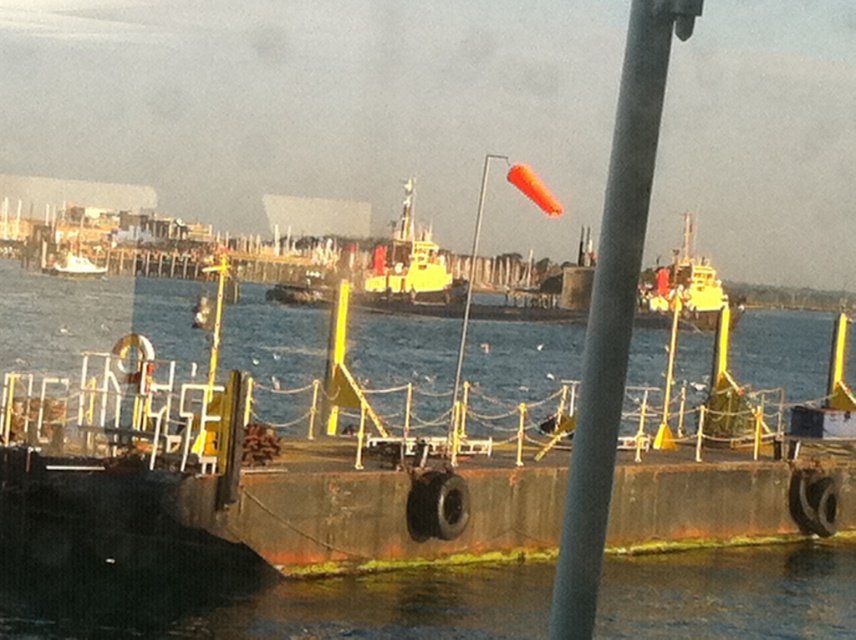
Between blue water at center and metallic gray pole at center, which one appears on the left side from the viewer's perspective?

blue water at center

Can you confirm if blue water at center is shorter than metallic gray pole at center?

In fact, blue water at center may be taller than metallic gray pole at center.

Locate an element on the screen. The width and height of the screenshot is (856, 640). blue water at center is located at coordinates (88, 317).

Does blue water at center appear over white matte boat at left?

Actually, blue water at center is below white matte boat at left.

Who is lower down, blue water at center or white matte boat at left?

blue water at center is below.

Measure the distance between blue water at center and camera.

6.98 meters

At what (x,y) coordinates should I click in order to perform the action: click on blue water at center. Please return your answer as a coordinate pair (x, y). The height and width of the screenshot is (640, 856). Looking at the image, I should click on (88, 317).

Is metallic gray pole at center smaller than white matte boat at left?

No.

Who is positioned more to the right, metallic gray pole at center or white matte boat at left?

metallic gray pole at center is more to the right.

Describe the element at coordinates (613, 308) in the screenshot. I see `metallic gray pole at center` at that location.

Locate an element on the screen. metallic gray pole at center is located at coordinates (613, 308).